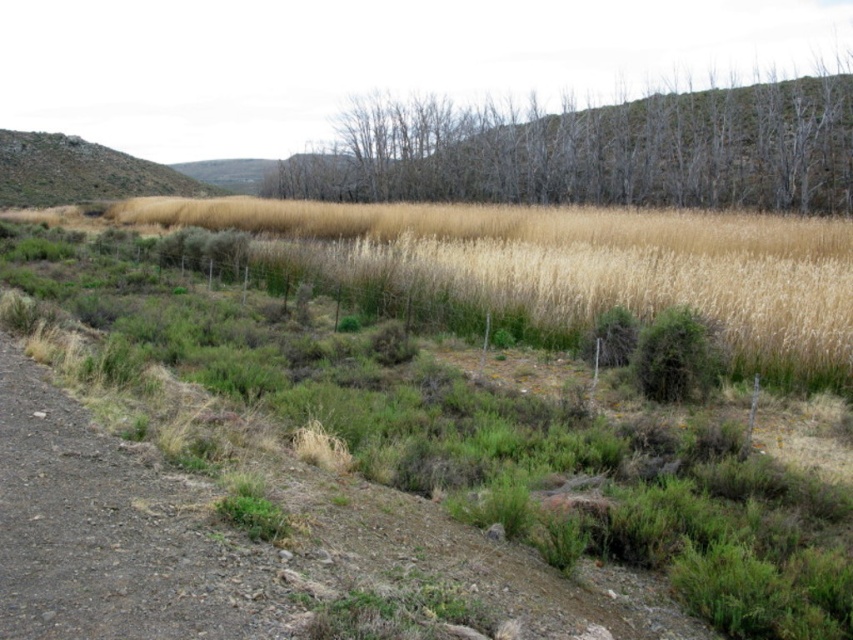
You are standing on the dirt road and want to walk towards the dry grass at center and the rugged brown hillside at upper left. Which one will you reach first?

You will reach the dry grass at center first because it is closer to the viewer than the rugged brown hillside at upper left.

You are standing at the dirt road in the foreground of the rural landscape. You see the bare wood trees at center and the rugged brown hillside at upper left. Which object is positioned to the right of the other?

The bare wood trees at center is to the right of rugged brown hillside at upper left.